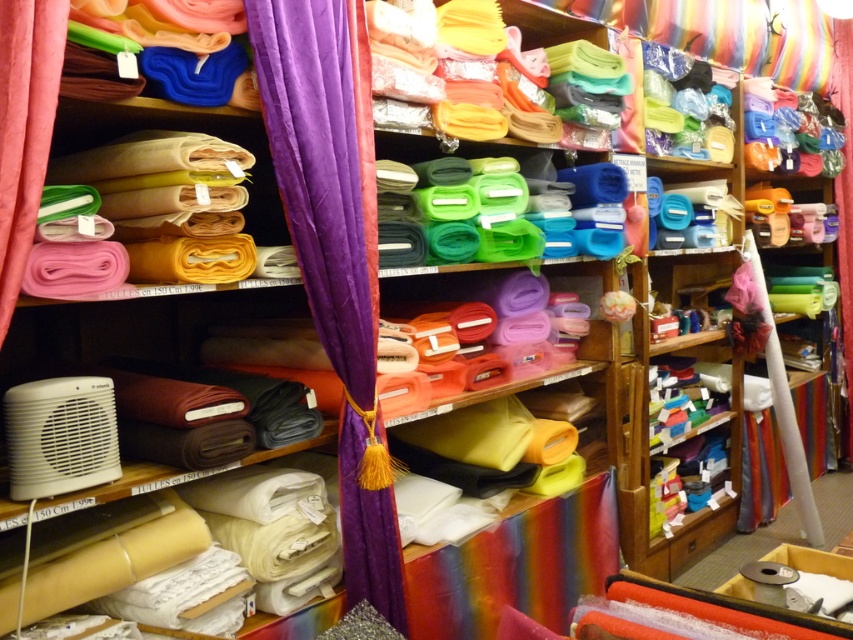
In the fabric store scene, you see the purple velvet curtain at center and the pink fabric at left. Which one is positioned more to the right side of the store?

The purple velvet curtain at center is positioned more to the right side of the store than the pink fabric at left.

You are organizing a display in the fabric store and need to arrange the purple velvet curtain at center and the pink fabric at left. Which object should be placed higher on the shelf to match their actual sizes?

The purple velvet curtain at center should be placed higher on the shelf since it has a greater height compared to the pink fabric at left.